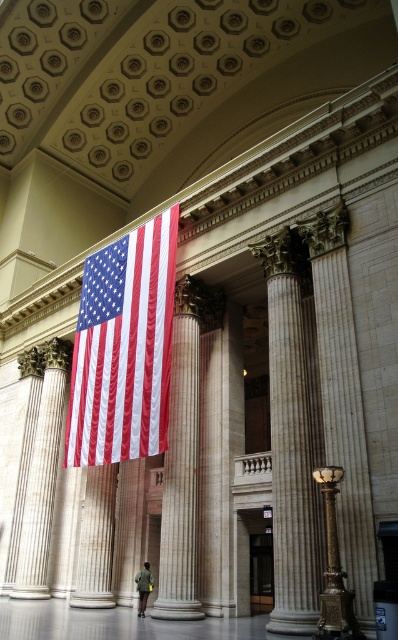
You are standing in the grand neoclassical building and want to reach a specific point marked at coordinates point (x=140, y=300). If your current position is 100 feet away from that point, can you walk directly to it without any obstacles?

The distance of point (x=140, y=300) from viewer is 143.94 feet. Since you are currently 100 feet away from it, you are still 43.94 feet away and can walk directly to it if there are no obstacles in between.

You are standing in the grand neoclassical building and want to pick up the dark green fabric jacket at center. The beige marble column at center is blocking your path. Can you walk around the column to reach the jacket without moving the column?

The beige marble column at center is 8.55 meters away from dark green fabric jacket at center, so there is enough space to walk around the column to reach the jacket without moving it.

In the scene shown: You are an interior designer planning to place a new sculpture between the beige marble column at center and the dark green fabric jacket at center. Which object should the sculpture be placed closer to if you want it to balance the visual weight based on their sizes?

The sculpture should be placed closer to the beige marble column at center because it is wider than the dark green fabric jacket at center, so balancing the visual weight requires placing the sculpture closer to the larger object.